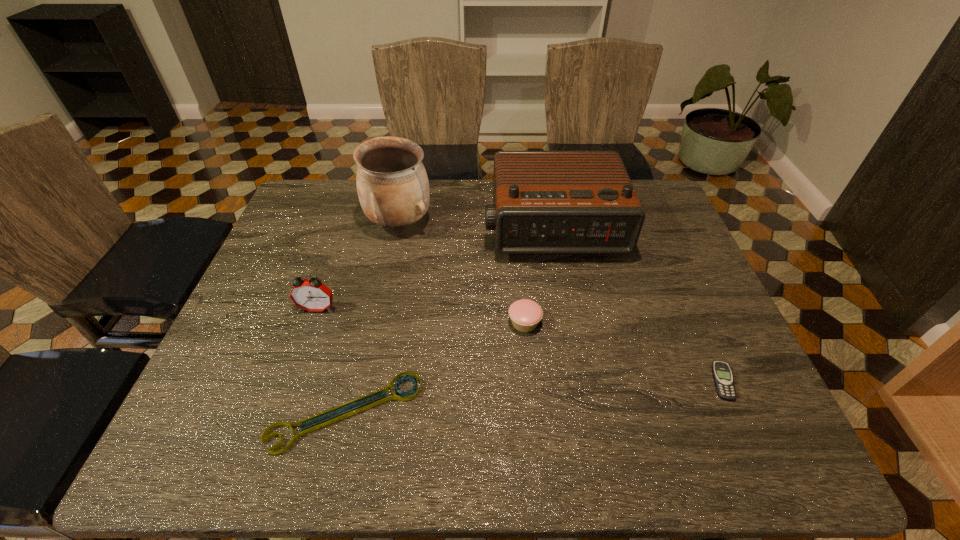
At what (x,y) coordinates should I click in order to perform the action: click on free space at the right edge of the desktop. Please return your answer as a coordinate pair (x, y). The image size is (960, 540). Looking at the image, I should click on (643, 259).

Where is `free space between the urn and the radio receiver`? This screenshot has height=540, width=960. free space between the urn and the radio receiver is located at coordinates (475, 226).

The image size is (960, 540). I want to click on free spot between the beeper and the second tallest object, so click(637, 306).

Where is `free point between the wrench and the rightmost object`? The width and height of the screenshot is (960, 540). free point between the wrench and the rightmost object is located at coordinates (535, 397).

Find the location of a particular element. The image size is (960, 540). vacant area between the urn and the beeper is located at coordinates (561, 302).

Identify the location of free space between the urn and the wrench. This screenshot has width=960, height=540. (372, 318).

Where is `empty space between the wrench and the radio receiver`? This screenshot has height=540, width=960. empty space between the wrench and the radio receiver is located at coordinates (449, 321).

At what (x,y) coordinates should I click in order to perform the action: click on unoccupied area between the third shortest object and the wrench. Please return your answer as a coordinate pair (x, y). Looking at the image, I should click on (436, 367).

You are a GUI agent. You are given a task and a screenshot of the screen. Output one action in this format:
    pyautogui.click(x=<x>, y=<y>)
    Task: Click on the unoccupied area between the radio receiver and the urn
    The height and width of the screenshot is (540, 960).
    Given the screenshot: What is the action you would take?
    pyautogui.click(x=475, y=226)

This screenshot has width=960, height=540. I want to click on free space that is in between the second tallest object and the urn, so click(475, 226).